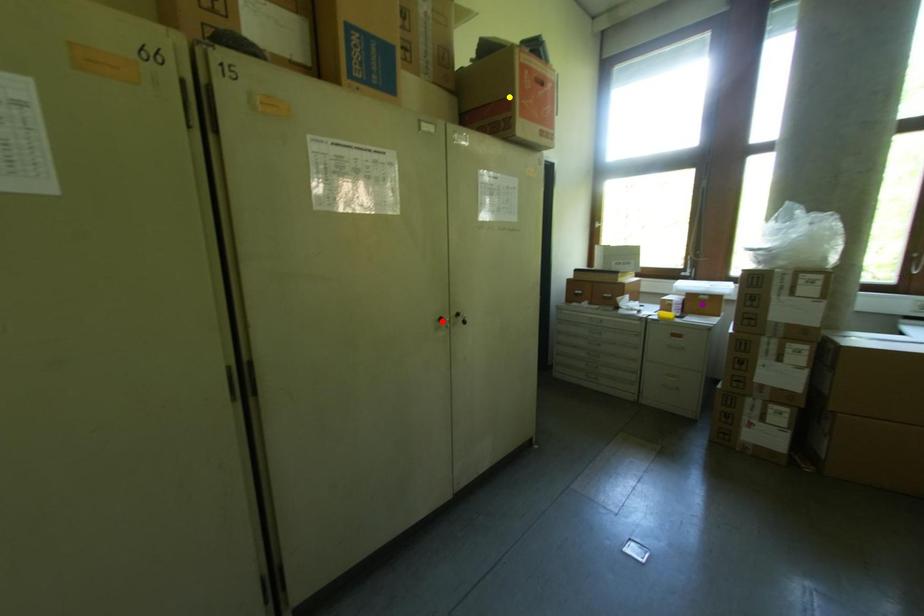
Order these from nearest to farthest:
A) purple point
B) red point
C) yellow point

red point
yellow point
purple point